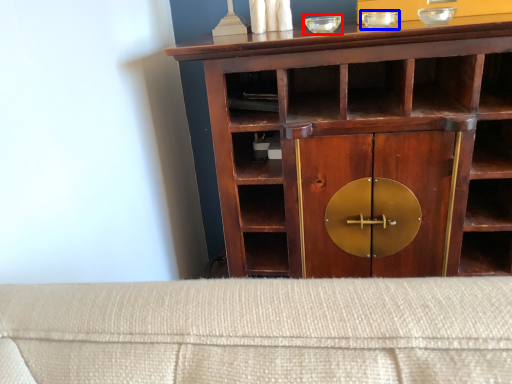
Question: Which object is further to the camera taking this photo, glass bowl (highlighted by a red box) or glass bowl (highlighted by a blue box)?

Choices:
 (A) glass bowl
 (B) glass bowl

Answer: (A)